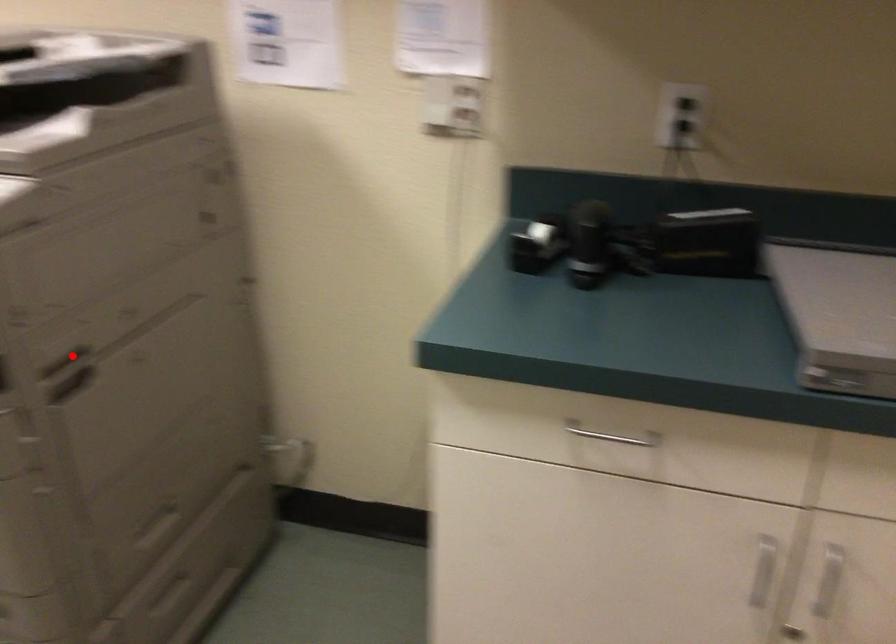
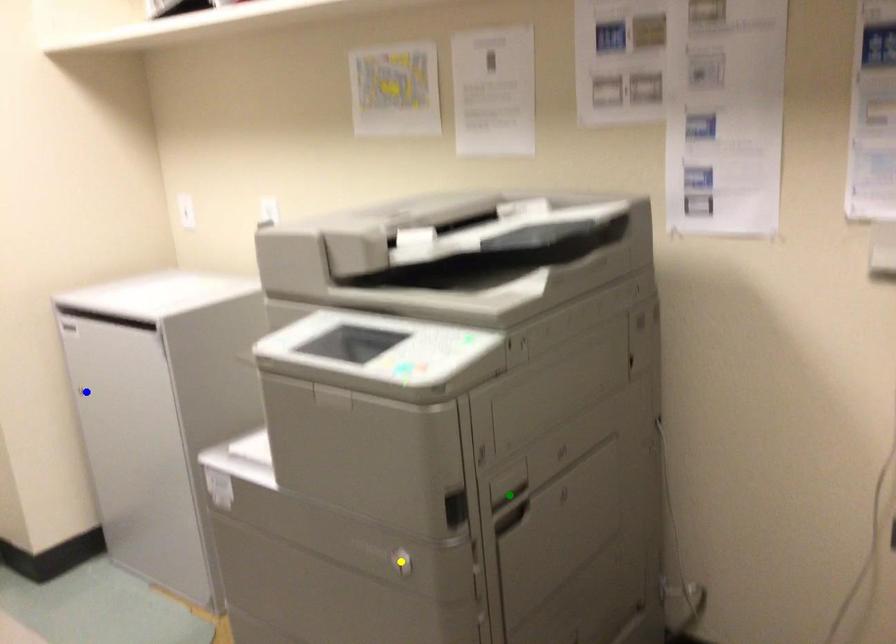
Question: I am providing you with two images of the same scene from different viewpoints. A red point is marked on the first image. You are given multiple points on the second image. Which spot in image 2 lines up with the point in image 1?

Choices:
 (A) blue point
 (B) green point
 (C) yellow point

Answer: (B)